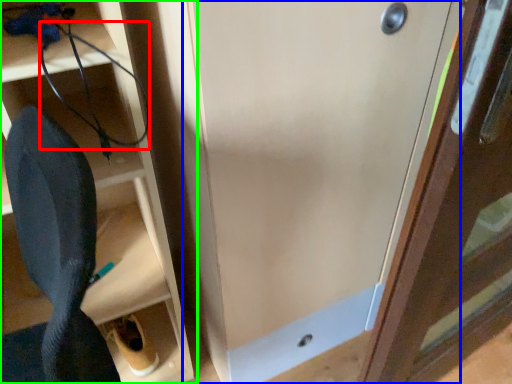
Question: Which object is positioned farthest from wire (highlighted by a red box)? Select from door (highlighted by a blue box) and shelf (highlighted by a green box).

Choices:
 (A) door
 (B) shelf

Answer: (A)